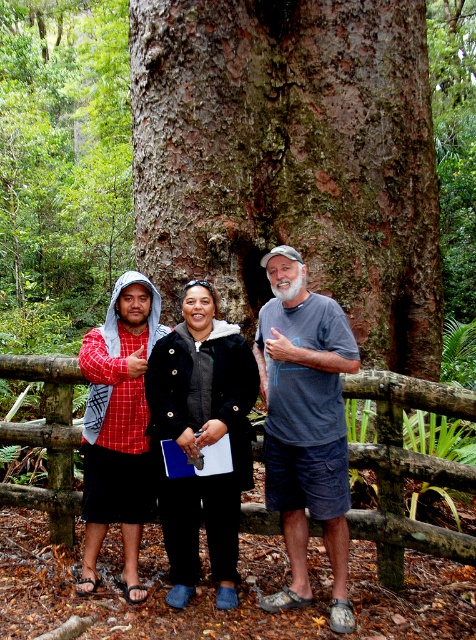
Describe the element at coordinates (399, 426) in the screenshot. I see `wooden at center` at that location.

Measure the distance between point (69, 481) and camera.

4.12 meters

The image size is (476, 640). What are the coordinates of `wooden at center` in the screenshot? It's located at (399, 426).

At what (x,y) coordinates should I click in order to perform the action: click on black fuzzy jacket at center. Please return your answer as a coordinate pair (x, y). This screenshot has height=640, width=476. Looking at the image, I should click on (201, 438).

Does black fuzzy jacket at center have a greater width compared to wooden at center?

In fact, black fuzzy jacket at center might be narrower than wooden at center.

The width and height of the screenshot is (476, 640). I want to click on black fuzzy jacket at center, so (x=201, y=438).

Where is `black fuzzy jacket at center`? This screenshot has width=476, height=640. black fuzzy jacket at center is located at coordinates (x=201, y=438).

Does gray cotton t-shirt at center have a greater width compared to wooden at center?

No, gray cotton t-shirt at center is not wider than wooden at center.

Can you confirm if gray cotton t-shirt at center is positioned above wooden at center?

Indeed, gray cotton t-shirt at center is positioned over wooden at center.

In order to click on gray cotton t-shirt at center in this screenshot , I will do `click(305, 424)`.